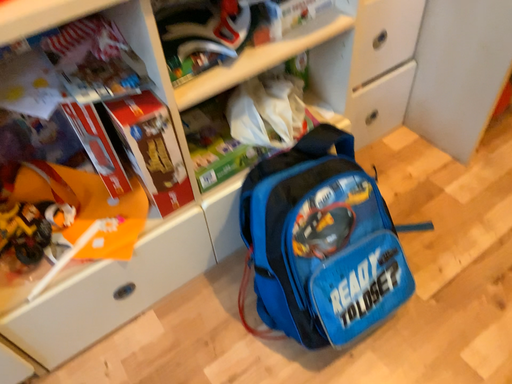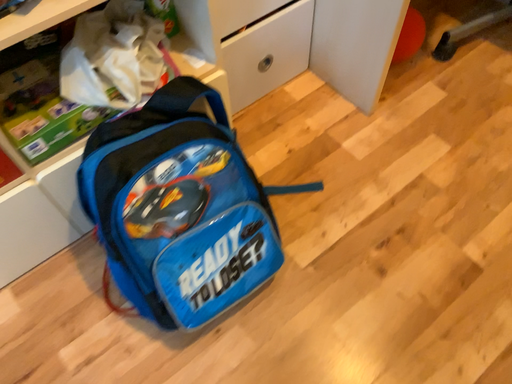
Question: Which way did the camera rotate in the video?

Choices:
 (A) rotated downward
 (B) rotated upward

Answer: (A)